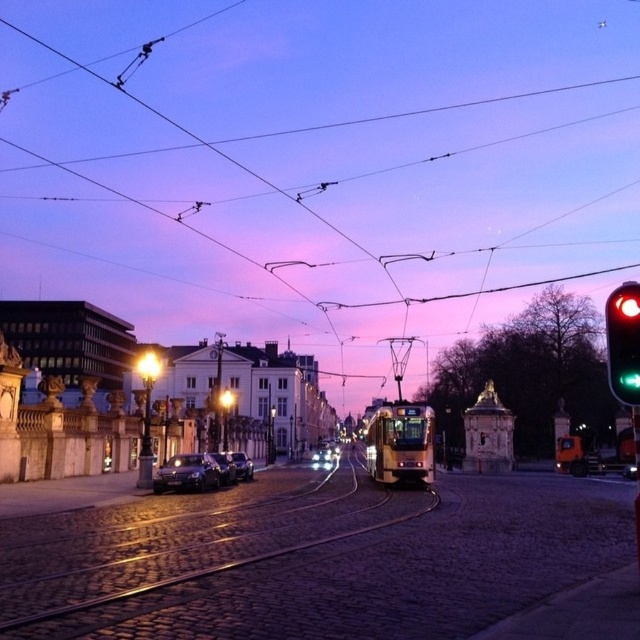
Question: Which point appears farthest from the camera in this image?

Choices:
 (A) (230, 465)
 (B) (244, 470)

Answer: (B)

Question: Among these objects, which one is nearest to the camera?

Choices:
 (A) metallic wire at center
 (B) sleek silver sedan at center
 (C) satin black sedan at lower left

Answer: (C)

Question: Which object is closer to the camera taking this photo?

Choices:
 (A) green glass traffic light at right
 (B) metallic wire at center
 (C) shiny black sedan at center

Answer: (A)

Question: Considering the relative positions of satin black sedan at lower left and shiny black sedan at center in the image provided, where is satin black sedan at lower left located with respect to shiny black sedan at center?

Choices:
 (A) left
 (B) right

Answer: (A)

Question: Does green glass traffic light at right have a lesser width compared to sleek silver sedan at center?

Choices:
 (A) no
 (B) yes

Answer: (A)

Question: Is metallic wire at center smaller than green glass traffic light at right?

Choices:
 (A) no
 (B) yes

Answer: (A)